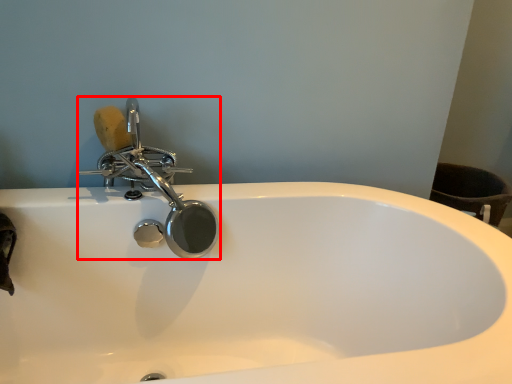
Question: Observing the image, what is the correct spatial positioning of tap (annotated by the red box) in reference to soap?

Choices:
 (A) right
 (B) left

Answer: (A)